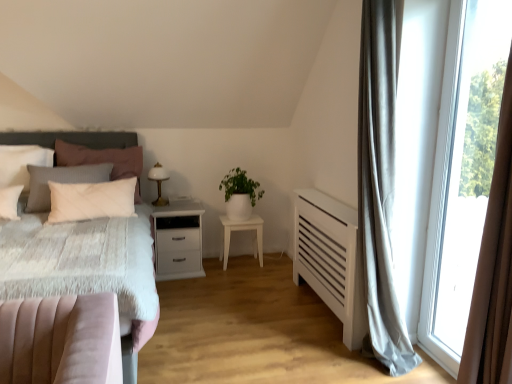
I want to click on vacant space to the right of white matte nightstand at center, the 2th nightstand from the left, so click(x=274, y=264).